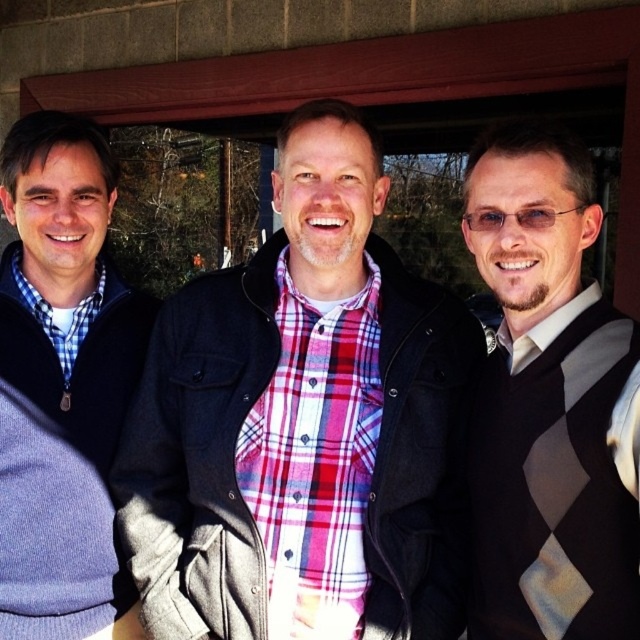
In the scene shown: Does argyle sweater vest at right lie behind matte black sweater at left?

No, it is in front of matte black sweater at left.

You are a GUI agent. You are given a task and a screenshot of the screen. Output one action in this format:
    pyautogui.click(x=<x>, y=<y>)
    Task: Click on the argyle sweater vest at right
    The image size is (640, 640).
    Given the screenshot: What is the action you would take?
    pyautogui.click(x=548, y=403)

The height and width of the screenshot is (640, 640). I want to click on argyle sweater vest at right, so click(x=548, y=403).

Does plaid shirt at center have a lesser width compared to argyle sweater vest at right?

In fact, plaid shirt at center might be wider than argyle sweater vest at right.

Is plaid shirt at center wider than argyle sweater vest at right?

Correct, the width of plaid shirt at center exceeds that of argyle sweater vest at right.

Which is in front, point (365, 448) or point (502, 426)?

Positioned in front is point (502, 426).

At what (x,y) coordinates should I click in order to perform the action: click on plaid shirt at center. Please return your answer as a coordinate pair (x, y). The image size is (640, 640). Looking at the image, I should click on (301, 422).

Does plaid shirt at center appear over matte black sweater at left?

No.

Locate an element on the screen. The height and width of the screenshot is (640, 640). plaid shirt at center is located at coordinates (301, 422).

Is point (332, 452) farther from camera compared to point (77, 230)?

No, it is in front of (77, 230).

Where is `plaid shirt at center`? The height and width of the screenshot is (640, 640). plaid shirt at center is located at coordinates (301, 422).